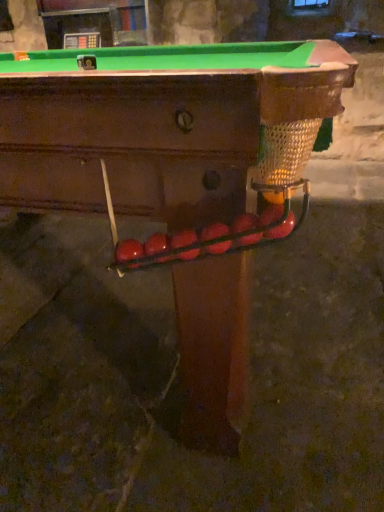
Question: From the image's perspective, is glossy red ball at center, which ranks as the fifth fruit in left-to-right order, above glossy red apple at right, which ranks as the first fruit in right-to-left order?

Choices:
 (A) yes
 (B) no

Answer: (B)

Question: Is glossy red ball at center, the 2th fruit from the right, at the left side of glossy red apple at right, which ranks as the first fruit in right-to-left order?

Choices:
 (A) no
 (B) yes

Answer: (B)

Question: Is glossy red ball at center, which ranks as the fifth fruit in left-to-right order, touching glossy red apple at right, placed as the sixth fruit when sorted from left to right?

Choices:
 (A) no
 (B) yes

Answer: (B)

Question: Is glossy red ball at center, the 2th fruit from the right, bigger than glossy red apple at right, which ranks as the first fruit in right-to-left order?

Choices:
 (A) no
 (B) yes

Answer: (B)

Question: Can you confirm if glossy red ball at center, the 2th fruit from the right, is shorter than glossy red apple at right, placed as the sixth fruit when sorted from left to right?

Choices:
 (A) no
 (B) yes

Answer: (B)

Question: Can you confirm if glossy red ball at center, which ranks as the fifth fruit in left-to-right order, is smaller than glossy red apple at right, which ranks as the first fruit in right-to-left order?

Choices:
 (A) no
 (B) yes

Answer: (A)

Question: Is glossy red ball at center, the 2th fruit from the right, oriented towards glossy red balls at center, placed as the 2th fruit when sorted from left to right?

Choices:
 (A) yes
 (B) no

Answer: (B)

Question: Is glossy red balls at center, placed as the 2th fruit when sorted from left to right, at the back of glossy red ball at center, the 2th fruit from the right?

Choices:
 (A) yes
 (B) no

Answer: (B)

Question: Is there a large distance between glossy red ball at center, the 2th fruit from the right, and glossy red balls at center, placed as the 2th fruit when sorted from left to right?

Choices:
 (A) no
 (B) yes

Answer: (A)

Question: Does glossy red ball at center, which ranks as the fifth fruit in left-to-right order, have a greater width compared to glossy red balls at center, placed as the 2th fruit when sorted from left to right?

Choices:
 (A) yes
 (B) no

Answer: (A)

Question: From the image's perspective, is glossy red ball at center, which ranks as the fifth fruit in left-to-right order, over glossy red balls at center, placed as the 2th fruit when sorted from left to right?

Choices:
 (A) yes
 (B) no

Answer: (A)

Question: Is glossy red ball at center, the 2th fruit from the right, placed right next to glossy red balls at center, the fifth fruit in the right-to-left sequence?

Choices:
 (A) yes
 (B) no

Answer: (B)

Question: Considering the relative sizes of rubberized red ball at center, which appears as the 3th fruit when viewed from the left, and glossy red balls at center, placed as the 2th fruit when sorted from left to right, in the image provided, is rubberized red ball at center, which appears as the 3th fruit when viewed from the left, bigger than glossy red balls at center, placed as the 2th fruit when sorted from left to right,?

Choices:
 (A) no
 (B) yes

Answer: (B)